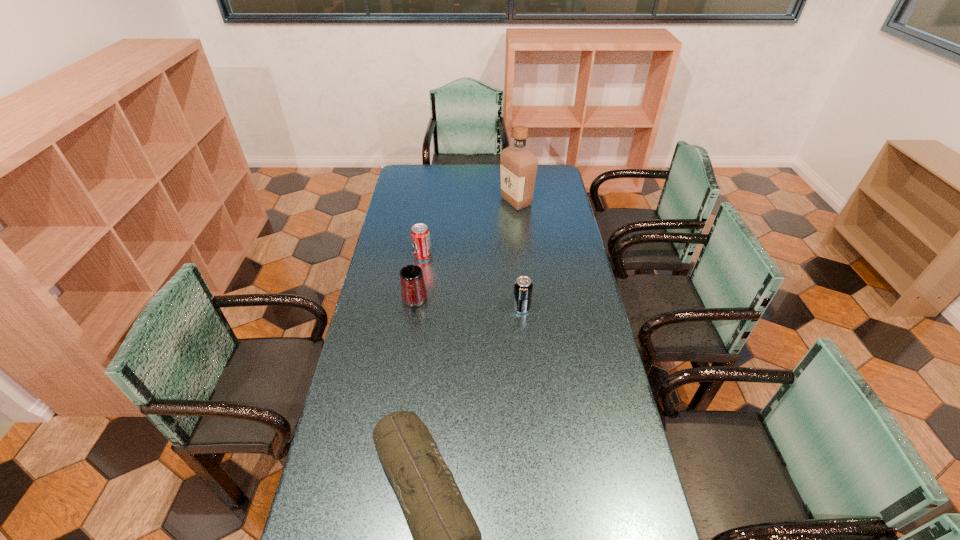
Where is `vacant space located 0.100m on the side of the mug with the handle`? This screenshot has width=960, height=540. vacant space located 0.100m on the side of the mug with the handle is located at coordinates (409, 335).

You are a GUI agent. You are given a task and a screenshot of the screen. Output one action in this format:
    pyautogui.click(x=<x>, y=<y>)
    Task: Click on the vacant space located 0.320m on the left of the nearer soda can
    
    Given the screenshot: What is the action you would take?
    pyautogui.click(x=429, y=308)

Where is `soda located in the left edge section of the desktop`? This screenshot has width=960, height=540. soda located in the left edge section of the desktop is located at coordinates (420, 235).

Where is `mug that is at the left edge`? Image resolution: width=960 pixels, height=540 pixels. mug that is at the left edge is located at coordinates (413, 290).

You are a GUI agent. You are given a task and a screenshot of the screen. Output one action in this format:
    pyautogui.click(x=<x>, y=<y>)
    Task: Click on the free space at the left edge of the desktop
    Image resolution: width=960 pixels, height=540 pixels.
    Given the screenshot: What is the action you would take?
    pyautogui.click(x=387, y=251)

Where is `free space at the right edge of the desktop`? free space at the right edge of the desktop is located at coordinates (618, 432).

Locate an element on the screen. This screenshot has width=960, height=540. vacant space at the far left corner of the desktop is located at coordinates (403, 175).

Find the location of a particular element. empty space that is in between the right soda can and the liquor is located at coordinates (518, 255).

The image size is (960, 540). I want to click on free space between the nearer soda can and the tallest object, so click(518, 255).

This screenshot has height=540, width=960. I want to click on blank region between the mug and the right soda can, so [x=468, y=305].